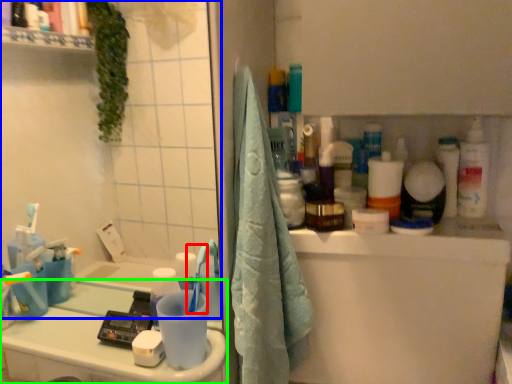
Question: Estimate the real-world distances between objects in this image. Which object is farther from toothbrush (highlighted by a red box), mirror (highlighted by a blue box) or counter top (highlighted by a green box)?

Choices:
 (A) mirror
 (B) counter top

Answer: (A)